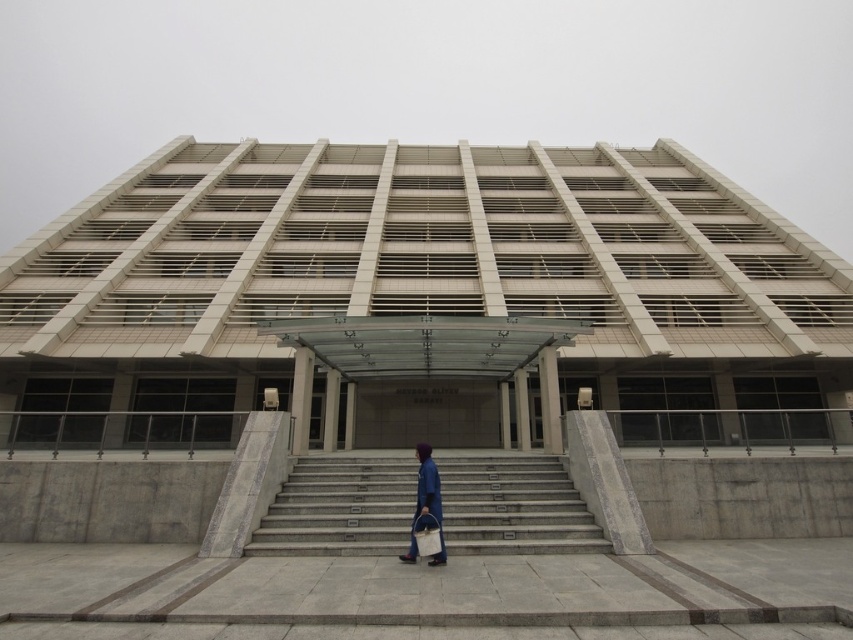
In the scene shown: Which is above, gray concrete stairs at center or blue fabric bag at center?

Positioned higher is blue fabric bag at center.

Who is lower down, gray concrete stairs at center or blue fabric bag at center?

Positioned lower is gray concrete stairs at center.

Which is in front, point (490, 481) or point (433, 506)?

Point (433, 506)

The width and height of the screenshot is (853, 640). In order to click on gray concrete stairs at center in this screenshot , I will do click(x=340, y=508).